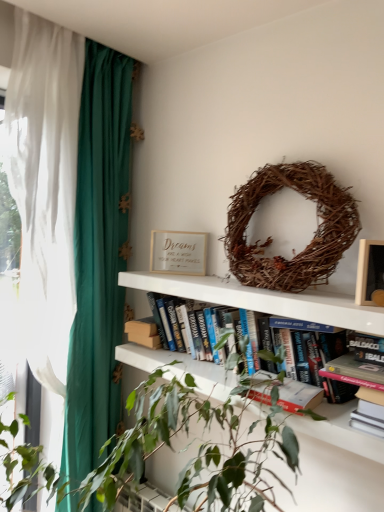
Image resolution: width=384 pixels, height=512 pixels. Identify the location of green leafy plant at center. (168, 446).

Describe the element at coordinates (96, 253) in the screenshot. The height and width of the screenshot is (512, 384). I see `green fabric curtain at left` at that location.

This screenshot has width=384, height=512. I want to click on brown woven wreath at upper center, so 271,238.

The width and height of the screenshot is (384, 512). Describe the element at coordinates (271, 238) in the screenshot. I see `brown woven wreath at upper center` at that location.

Measure the distance between point (159, 248) and camera.

Point (159, 248) is 1.87 meters away from camera.

At what (x,y) coordinates should I click in order to perform the action: click on hardcover books at center. Please return your answer as a coordinate pair (x, y). Looking at the image, I should click on (163, 325).

Considering the sizes of hardcover books at center and green fabric curtain at left in the image, is hardcover books at center taller or shorter than green fabric curtain at left?

Clearly, hardcover books at center is shorter compared to green fabric curtain at left.

Between hardcover books at center and green fabric curtain at left, which one has smaller width?

hardcover books at center.

Is wooden picture frame at upper right far from brown woven wreath at upper center?

No, wooden picture frame at upper right is not far away from brown woven wreath at upper center.

Considering the positions of objects wooden picture frame at upper right and brown woven wreath at upper center in the image provided, who is behind, wooden picture frame at upper right or brown woven wreath at upper center?

Positioned behind is brown woven wreath at upper center.

From the image's perspective, between wooden picture frame at upper right and green leafy plant at center, which one is located above?

wooden picture frame at upper right, from the image's perspective.

How distant is wooden picture frame at upper right from green leafy plant at center?

wooden picture frame at upper right is 24.77 inches away from green leafy plant at center.

Where is `houseplant located in front of the wooden picture frame at upper right`? This screenshot has width=384, height=512. houseplant located in front of the wooden picture frame at upper right is located at coordinates (168, 446).

Is brown woven wreath at upper center taller than matte gold frame at upper center?

Yes, brown woven wreath at upper center is taller than matte gold frame at upper center.

Does point (259, 264) come farther from viewer compared to point (167, 247)?

No, it is not.

Is brown woven wreath at upper center next to matte gold frame at upper center?

brown woven wreath at upper center and matte gold frame at upper center are clearly separated.

From a real-world perspective, is wooden picture frame at upper right below matte gold frame at upper center?

No, from a real-world perspective, wooden picture frame at upper right is not under matte gold frame at upper center.

Is wooden picture frame at upper right looking in the opposite direction of matte gold frame at upper center?

wooden picture frame at upper right is not turned away from matte gold frame at upper center.

Between wooden picture frame at upper right and matte gold frame at upper center, which one has more height?

Standing taller between the two is matte gold frame at upper center.

From the image's perspective, who appears lower, wooden picture frame at upper right or matte gold frame at upper center?

wooden picture frame at upper right is shown below in the image.

In the image, is matte gold frame at upper center on the left side or the right side of green fabric curtain at left?

From the image, it's evident that matte gold frame at upper center is to the right of green fabric curtain at left.

Are matte gold frame at upper center and green fabric curtain at left far apart?

matte gold frame at upper center is actually quite close to green fabric curtain at left.

Is matte gold frame at upper center aimed at green fabric curtain at left?

No, matte gold frame at upper center does not turn towards green fabric curtain at left.

Based on the photo, what's the angular difference between green leafy plant at center and hardcover books at center's facing directions?

4.47 degrees.

Is green leafy plant at center facing towards hardcover books at center?

No, green leafy plant at center is not aimed at hardcover books at center.

Is green leafy plant at center bigger or smaller than hardcover books at center?

Considering their sizes, green leafy plant at center takes up more space than hardcover books at center.

Identify the location of curtain above the hardcover books at center (from a real-world perspective). The width and height of the screenshot is (384, 512). (96, 253).

This screenshot has width=384, height=512. Find the location of `bird nest on the left of wooden picture frame at upper right`. bird nest on the left of wooden picture frame at upper right is located at coordinates (271, 238).

Estimate the real-world distances between objects in this image. Which object is closer to matte gold frame at upper center, brown woven wreath at upper center or hardcover books at center?

hardcover books at center is positioned closer to the anchor matte gold frame at upper center.

Considering their positions, is green leafy plant at center positioned closer to matte gold frame at upper center than green fabric curtain at left?

green fabric curtain at left is closer to matte gold frame at upper center.

Considering their positions, is green fabric curtain at left positioned closer to matte gold frame at upper center than green leafy plant at center?

green fabric curtain at left is positioned closer to the anchor matte gold frame at upper center.

Looking at the image, which one is located closer to brown woven wreath at upper center, wooden picture frame at upper right or green fabric curtain at left?

wooden picture frame at upper right.

Which object lies nearer to the anchor point brown woven wreath at upper center, green fabric curtain at left or wooden picture frame at upper right?

wooden picture frame at upper right lies closer to brown woven wreath at upper center than the other object.

Based on their spatial positions, is matte gold frame at upper center or wooden picture frame at upper right further from green leafy plant at center?

matte gold frame at upper center is positioned further to the anchor green leafy plant at center.

Estimate the real-world distances between objects in this image. Which object is further from hardcover books at center, matte gold frame at upper center or green leafy plant at center?

Based on the image, green leafy plant at center appears to be further to hardcover books at center.

Based on their spatial positions, is matte gold frame at upper center or wooden picture frame at upper right closer to green fabric curtain at left?

matte gold frame at upper center.

Where is `book between green fabric curtain at left and wooden picture frame at upper right in the horizontal direction`? The image size is (384, 512). book between green fabric curtain at left and wooden picture frame at upper right in the horizontal direction is located at coordinates (163, 325).

This screenshot has width=384, height=512. In order to click on book between green leafy plant at center and green fabric curtain at left along the z-axis in this screenshot , I will do pyautogui.click(x=163, y=325).

I want to click on bird nest between wooden picture frame at upper right and matte gold frame at upper center from front to back, so click(271, 238).

I want to click on picture frame between green leafy plant at center and green fabric curtain at left along the z-axis, so click(x=370, y=274).